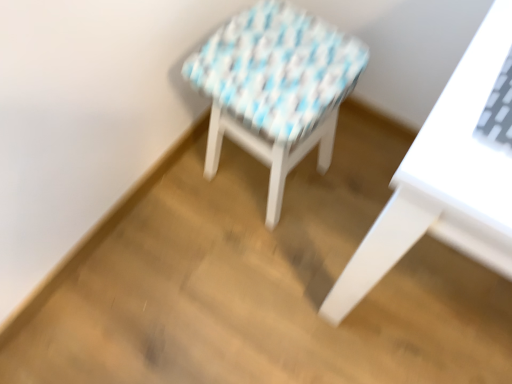
Find the location of `vacant space underneath white glossy table at right (from a real-world perspective)`. vacant space underneath white glossy table at right (from a real-world perspective) is located at coordinates (437, 306).